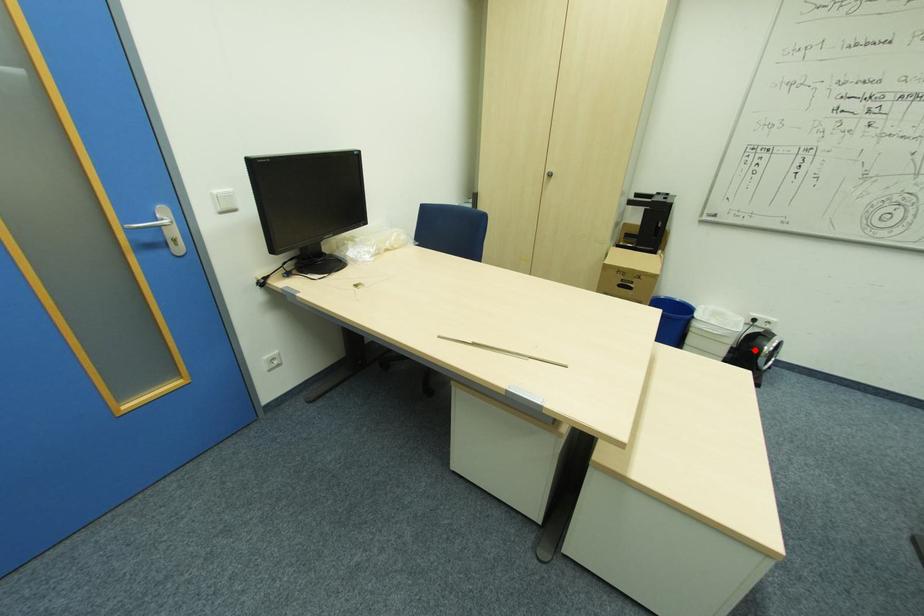
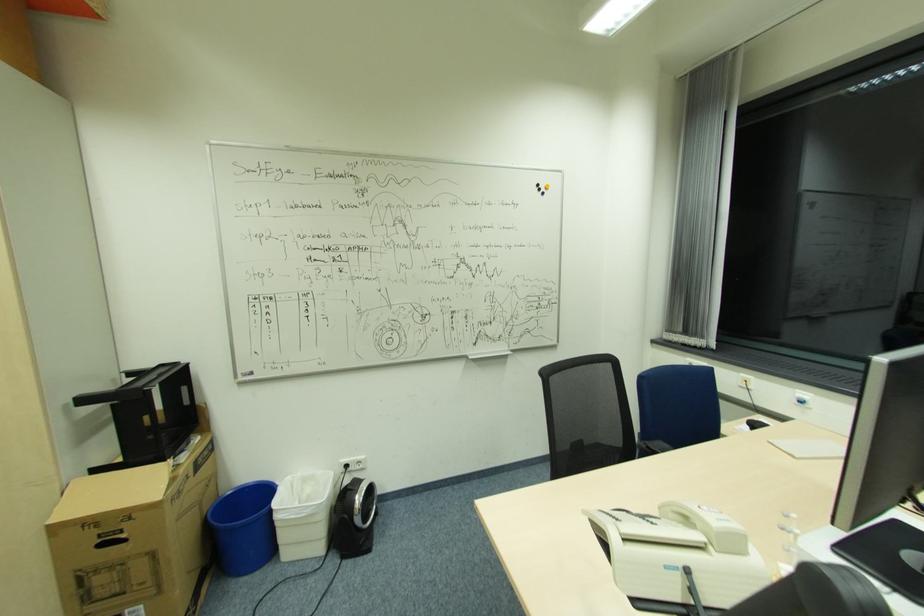
Question: I am providing you with two images of the same scene from different viewpoints. A red point is marked on the first image. Can you still see the location of the red point in image 2?

Choices:
 (A) Yes
 (B) No

Answer: (A)